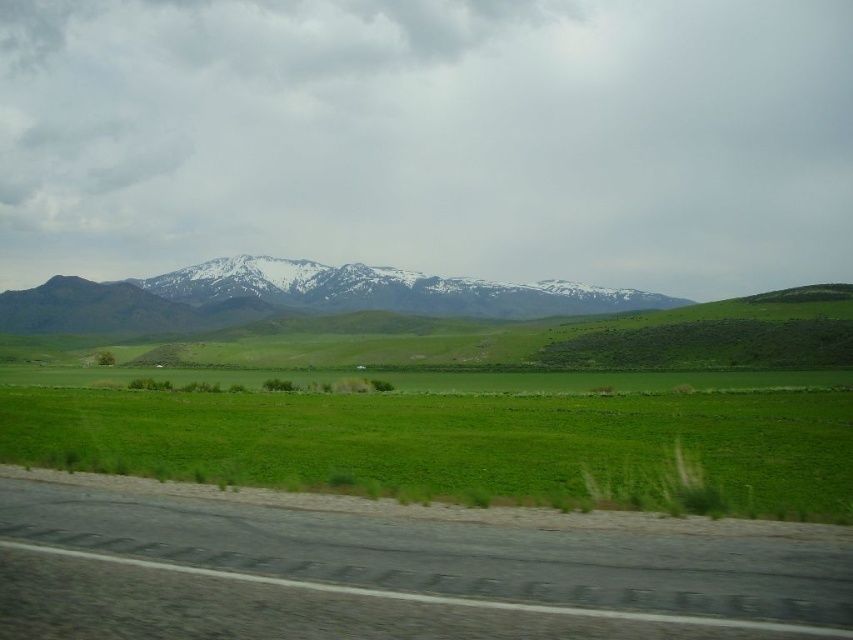
You are standing at the starting point of the paved road in the foreground and want to reach a specific location. There are two points marked in the image, point A at coordinates point (122, 541) and point B at coordinates point (581, 298). Which point should you head towards if you want to reach the one that is closer to you?

You should head towards point A at coordinates point (122, 541) because it is closer to the viewer than point B at coordinates point (581, 298).